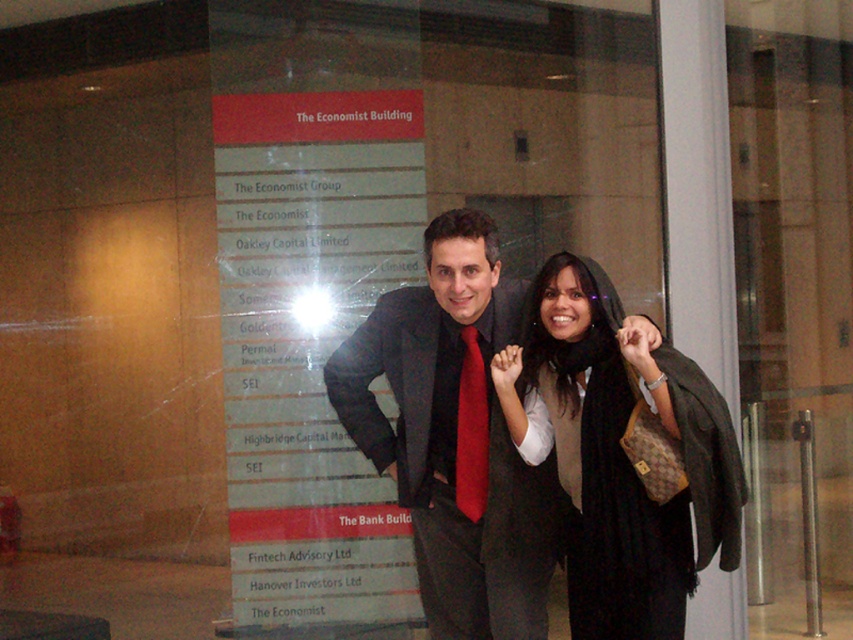
Does black fabric scarf at center have a lesser width compared to matte black suit at center?

Yes, black fabric scarf at center is thinner than matte black suit at center.

Can you confirm if black fabric scarf at center is taller than matte black suit at center?

Correct, black fabric scarf at center is much taller as matte black suit at center.

What do you see at coordinates (619, 452) in the screenshot?
I see `black fabric scarf at center` at bounding box center [619, 452].

At what (x,y) coordinates should I click in order to perform the action: click on black fabric scarf at center. Please return your answer as a coordinate pair (x, y). Looking at the image, I should click on (619, 452).

Between metallic signboard at center and matte black suit at center, which one appears on the right side from the viewer's perspective?

matte black suit at center is more to the right.

Who is more forward, (x=312, y=237) or (x=546, y=532)?

Point (x=546, y=532) is more forward.

Who is more forward, (370, 188) or (509, 600)?

Positioned in front is point (509, 600).

Where is `metallic signboard at center`? The image size is (853, 640). metallic signboard at center is located at coordinates (310, 342).

Who is taller, metallic signboard at center or black fabric scarf at center?

With more height is metallic signboard at center.

Is point (392, 573) more distant than point (697, 452)?

Yes, it is behind point (697, 452).

You are a GUI agent. You are given a task and a screenshot of the screen. Output one action in this format:
    pyautogui.click(x=<x>, y=<y>)
    Task: Click on the metallic signboard at center
    The width and height of the screenshot is (853, 640).
    Given the screenshot: What is the action you would take?
    point(310,342)